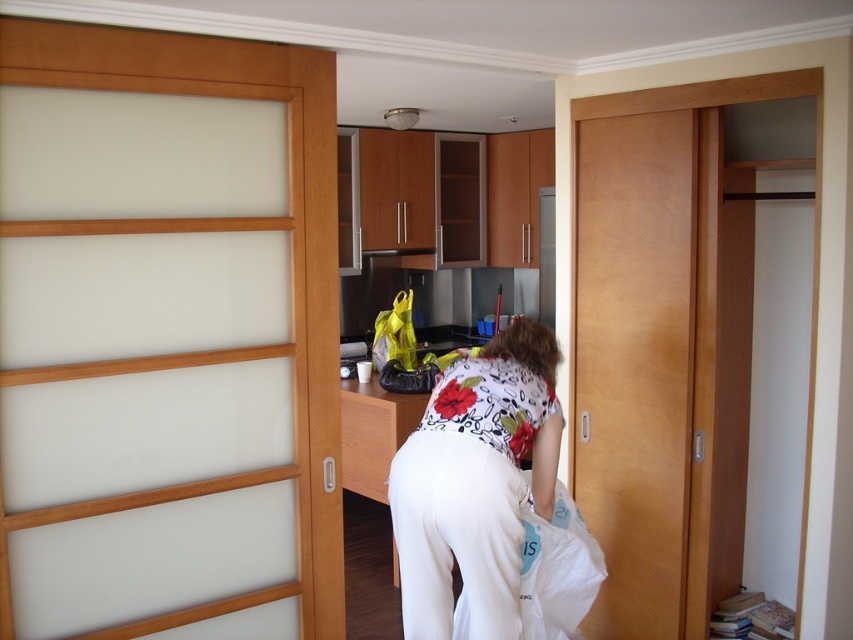
Can you confirm if beech wood door at right is shorter than white floral shirt at center?

No, beech wood door at right is not shorter than white floral shirt at center.

At what (x,y) coordinates should I click in order to perform the action: click on beech wood door at right. Please return your answer as a coordinate pair (x, y). The image size is (853, 640). Looking at the image, I should click on (634, 362).

Locate an element on the screen. The height and width of the screenshot is (640, 853). beech wood door at right is located at coordinates (634, 362).